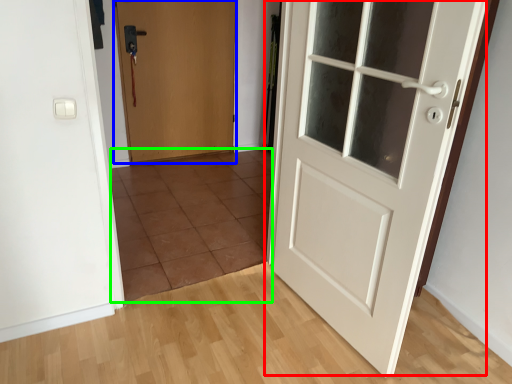
Question: Which is farther away from door (highlighted by a red box)? door (highlighted by a blue box) or tile (highlighted by a green box)?

Choices:
 (A) door
 (B) tile

Answer: (A)